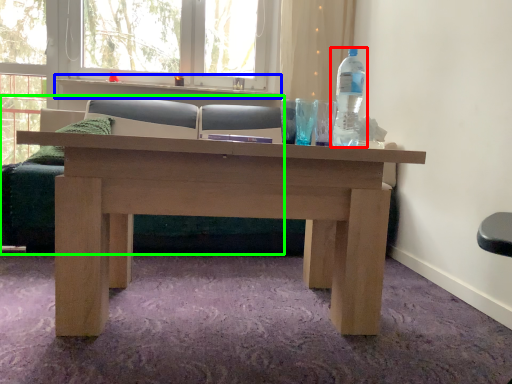
Question: Which is farther away from bottle (highlighted by a red box)? window sill (highlighted by a blue box) or studio couch (highlighted by a green box)?

Choices:
 (A) window sill
 (B) studio couch

Answer: (A)